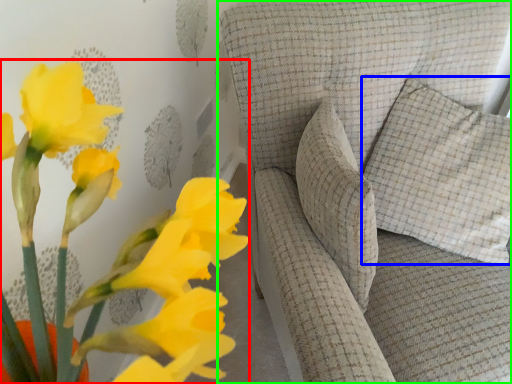
Question: Which object is positioned farthest from floral arrangement (highlighted by a red box)? Select from pillow (highlighted by a blue box) and furniture (highlighted by a green box).

Choices:
 (A) pillow
 (B) furniture

Answer: (A)